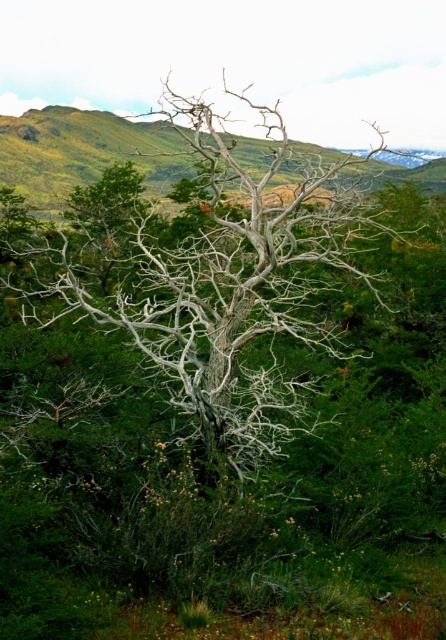
Question: Which point is closer to the camera taking this photo?

Choices:
 (A) (148, 212)
 (B) (169, 170)

Answer: (A)

Question: Observing the image, what is the correct spatial positioning of white bark tree at center in reference to gray bark tree at center?

Choices:
 (A) below
 (B) above

Answer: (A)

Question: Can you confirm if white bark tree at center is wider than gray bark tree at center?

Choices:
 (A) no
 (B) yes

Answer: (A)

Question: From the image, what is the correct spatial relationship of white bark tree at center in relation to gray bark tree at center?

Choices:
 (A) above
 (B) below

Answer: (B)